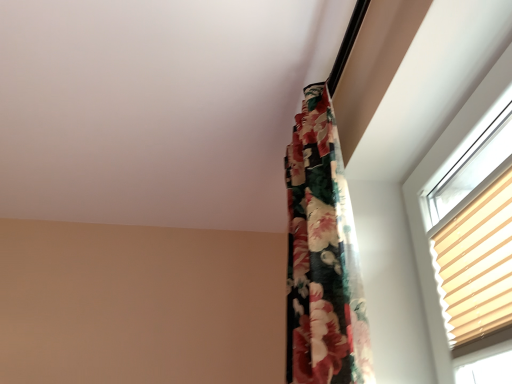
Question: Considering the positions of point (322, 367) and point (465, 309), is point (322, 367) closer or farther from the camera than point (465, 309)?

Choices:
 (A) farther
 (B) closer

Answer: (B)

Question: From a real-world perspective, is floral fabric curtain at upper right above or below beige pleated blind at upper right?

Choices:
 (A) below
 (B) above

Answer: (B)

Question: Is floral fabric curtain at upper right inside the boundaries of beige pleated blind at upper right, or outside?

Choices:
 (A) inside
 (B) outside

Answer: (B)

Question: Would you say beige pleated blind at upper right is to the left or to the right of floral fabric curtain at upper right in the picture?

Choices:
 (A) right
 (B) left

Answer: (A)

Question: Which is correct: beige pleated blind at upper right is inside floral fabric curtain at upper right, or outside of it?

Choices:
 (A) inside
 (B) outside

Answer: (B)

Question: Considering the positions of beige pleated blind at upper right and floral fabric curtain at upper right in the image, is beige pleated blind at upper right wider or thinner than floral fabric curtain at upper right?

Choices:
 (A) wide
 (B) thin

Answer: (B)

Question: Is beige pleated blind at upper right in front of or behind floral fabric curtain at upper right in the image?

Choices:
 (A) front
 (B) behind

Answer: (A)